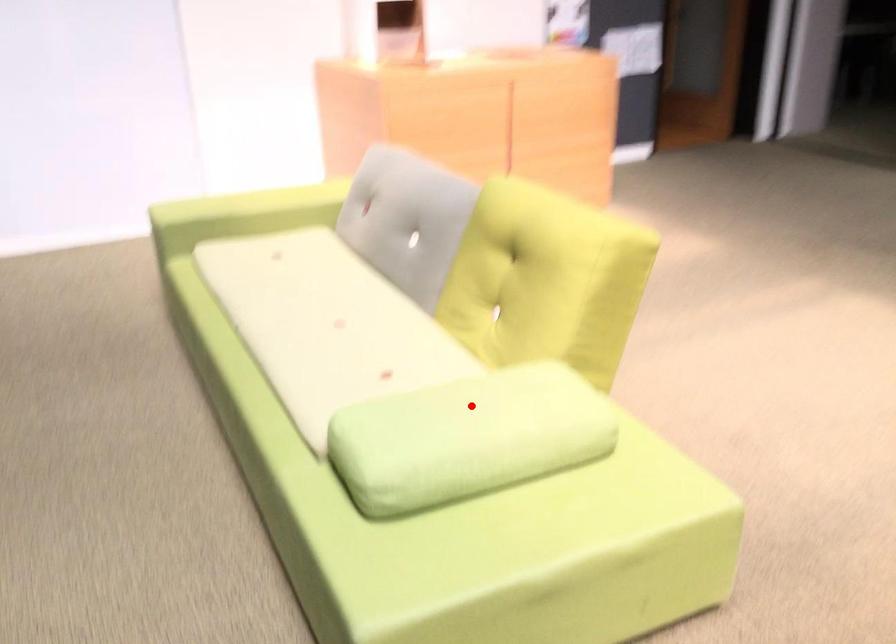
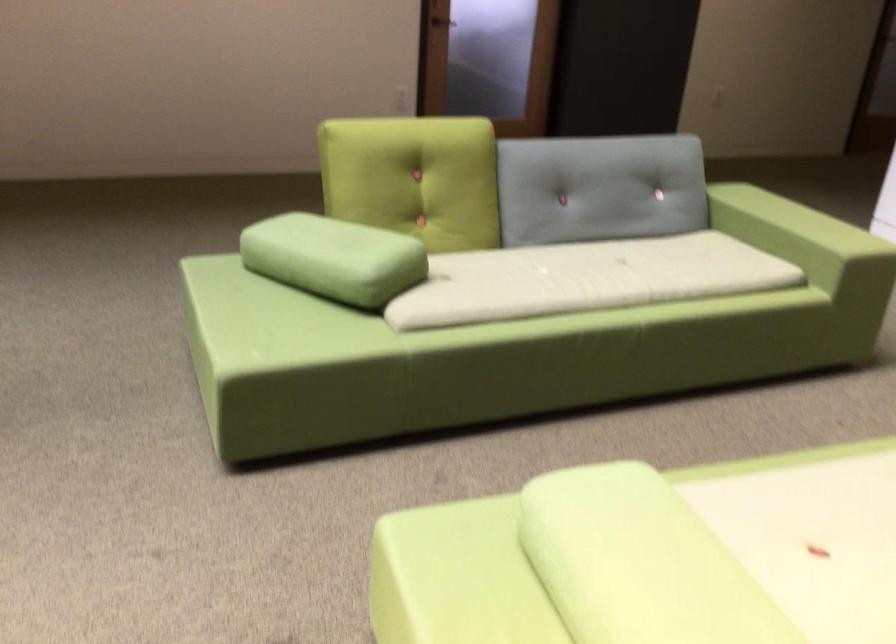
Find the pixel in the second image that matches the highlighted location in the first image.

(651, 556)